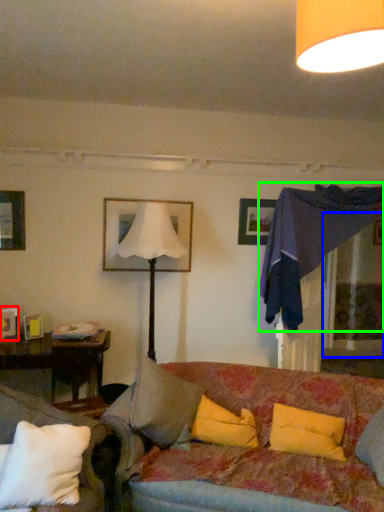
Question: Which is farther away from picture frame (highlighted by a red box)? glass door (highlighted by a blue box) or canopy bed (highlighted by a green box)?

Choices:
 (A) glass door
 (B) canopy bed

Answer: (A)